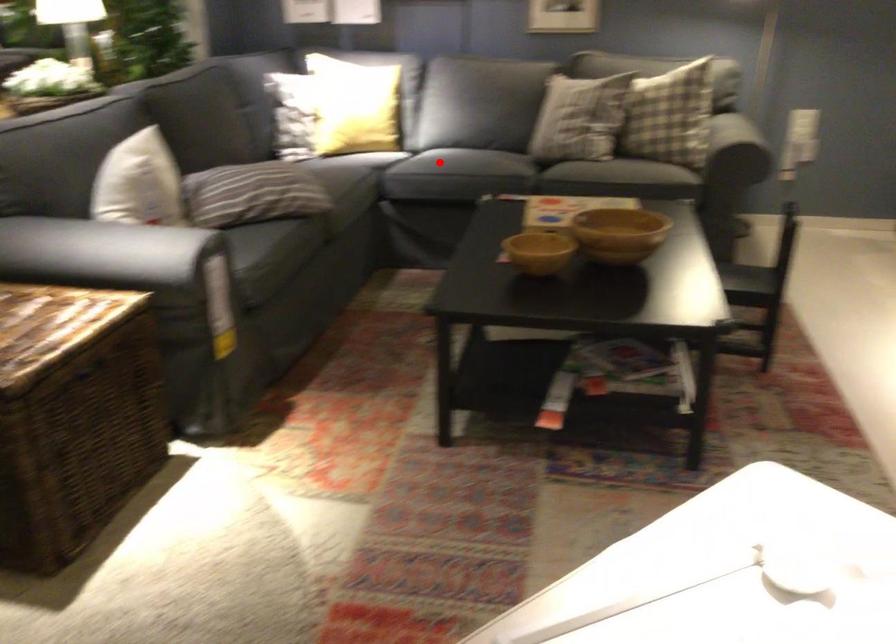
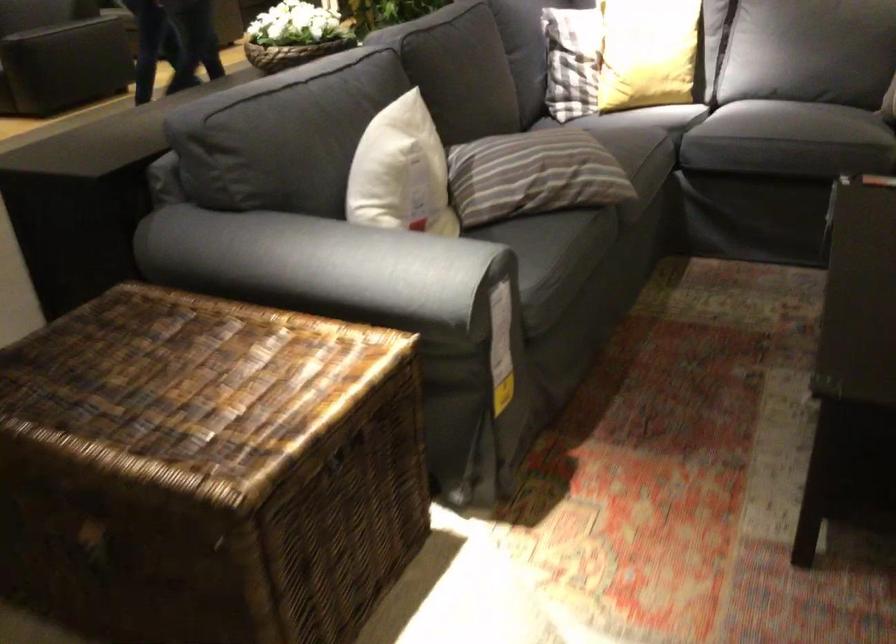
Question: I am providing you with two images of the same scene from different viewpoints. A red point is shown in image1. For the corresponding object point in image2, is it positioned nearer or farther from the camera?

Choices:
 (A) Nearer
 (B) Farther

Answer: (A)